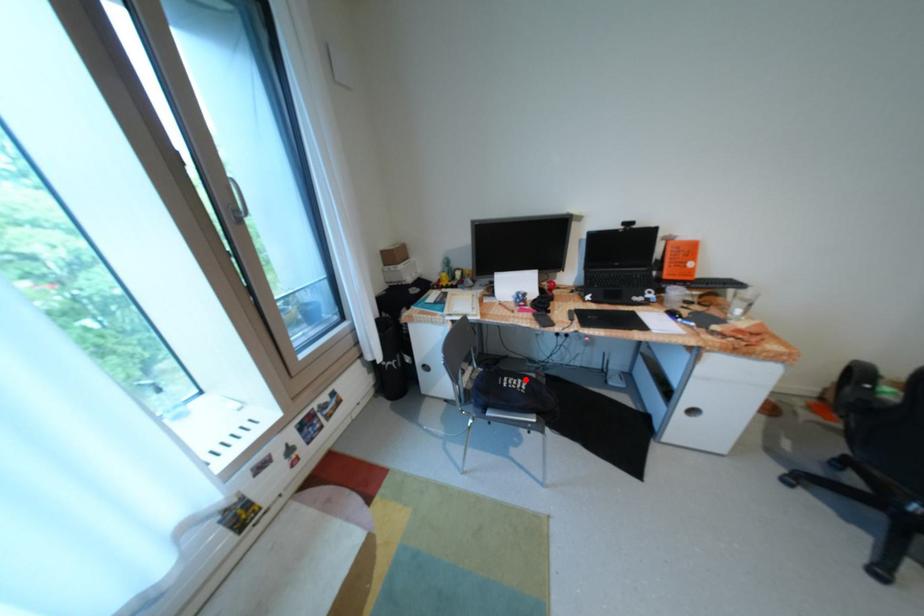
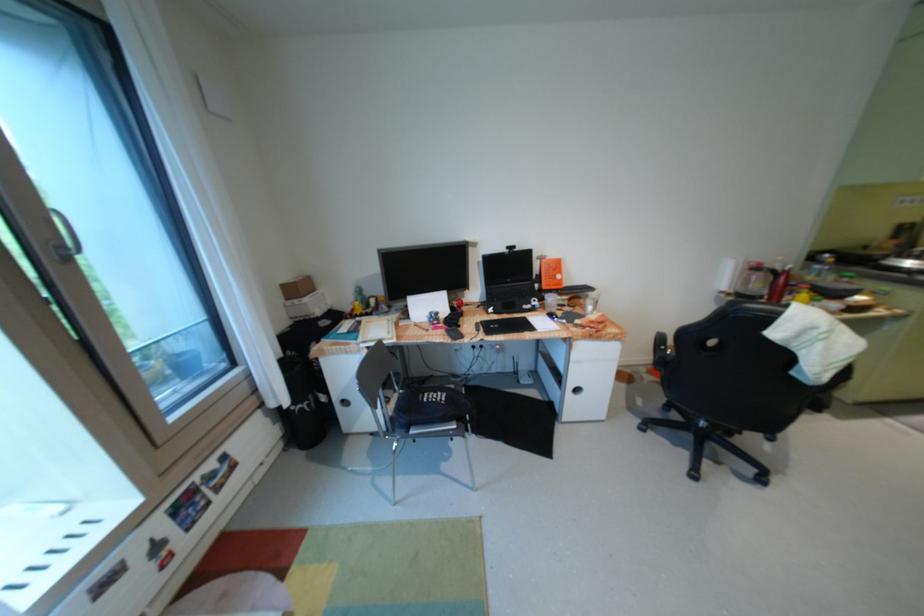
Question: I am providing you with two images of the same scene from different viewpoints. A red point is shown in image1. For the corresponding object point in image2, is it positioned nearer or farther from the camera?

Choices:
 (A) Nearer
 (B) Farther

Answer: (A)